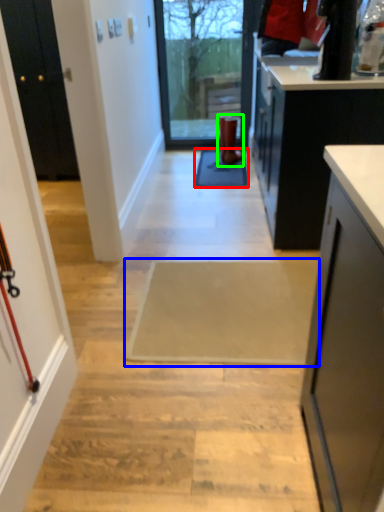
Question: Which is nearer to the doormat (highlighted by a red box)? doormat (highlighted by a blue box) or footwear (highlighted by a green box).

Choices:
 (A) doormat
 (B) footwear

Answer: (B)